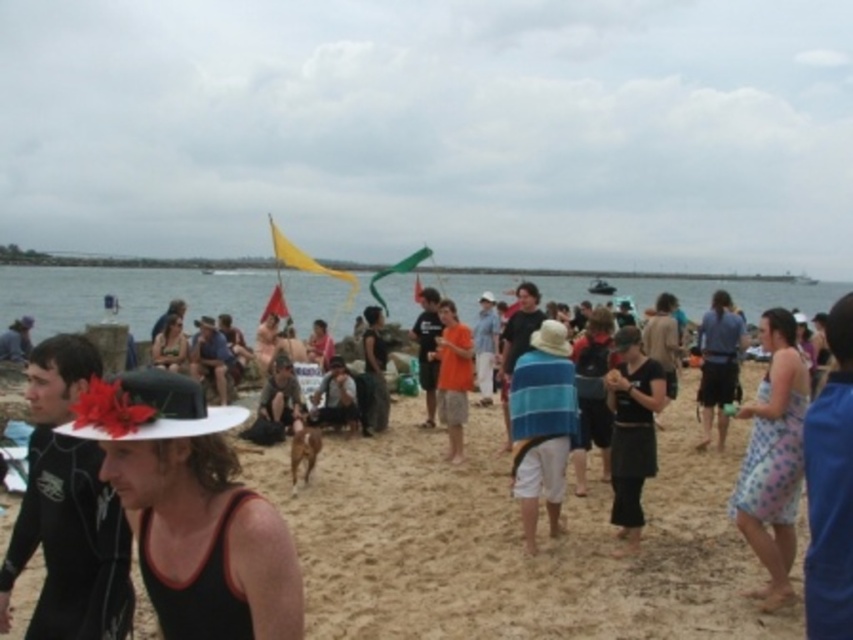
You are a photographer trying to capture a photo of the dark gray fabric at center and the matte black hat at left. Based on their positions, which object should you focus on first if you want to include both in the frame without moving the camera?

The matte black hat at left should be focused on first because the dark gray fabric at center is positioned to its right, meaning it is further away from the camera. By focusing on the closer object, the matte black hat at left, both objects will be in focus due to the depth of field.